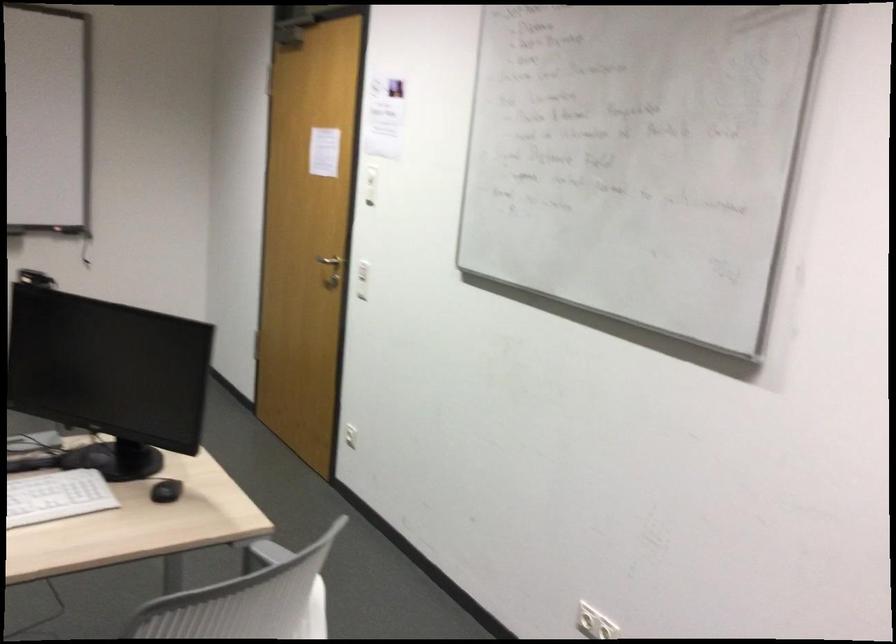
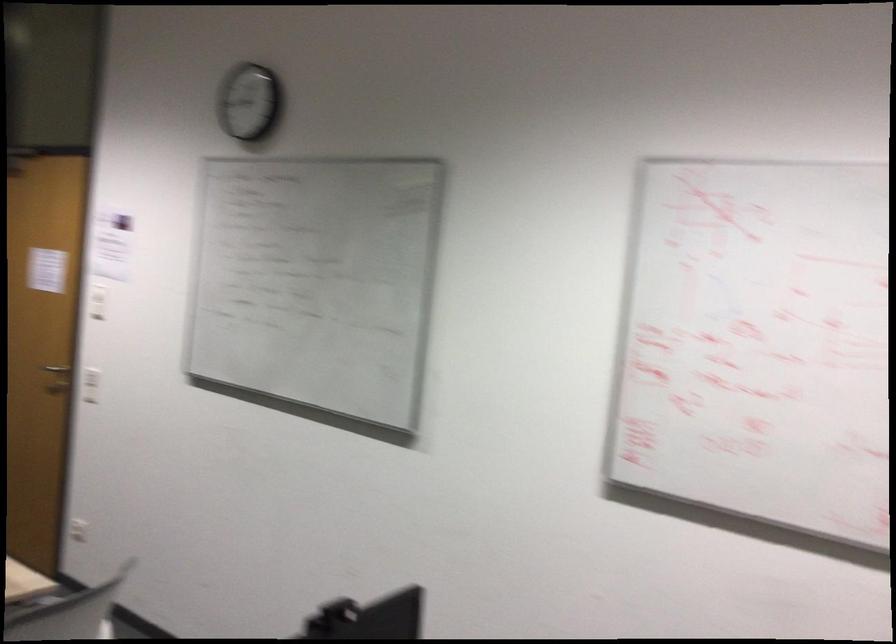
Where in the second image is the point corresponding to [312,252] from the first image?

(56, 368)